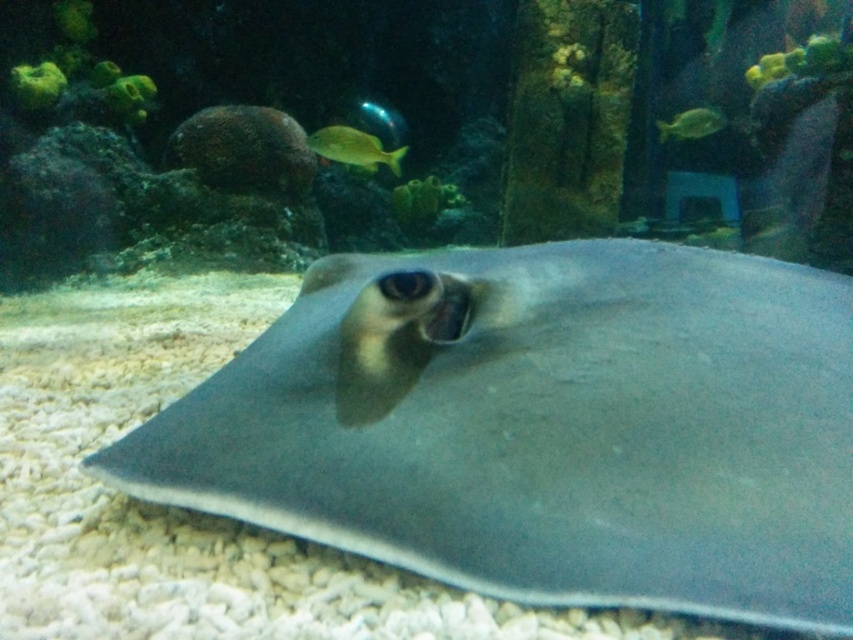
What are the coordinates of `smooth gray stingray at center` in the screenshot? It's located at (543, 426).

Does point (305, 365) lie in front of point (672, 128)?

That is True.

Is point (842, 448) positioned behind point (659, 125)?

No, it is not.

Identify the location of smooth gray stingray at center. The width and height of the screenshot is (853, 640). (543, 426).

Between yellow matte fish at upper center and green shiny fish at upper right, which one is positioned lower?

yellow matte fish at upper center is below.

Can you confirm if yellow matte fish at upper center is shorter than green shiny fish at upper right?

Correct, yellow matte fish at upper center is not as tall as green shiny fish at upper right.

Locate an element on the screen. This screenshot has height=640, width=853. yellow matte fish at upper center is located at coordinates (352, 147).

Which is more to the left, smooth gray stingray at center or yellow matte fish at upper center?

yellow matte fish at upper center is more to the left.

Is point (689, 401) positioned before point (347, 163)?

Yes, it is in front of point (347, 163).

I want to click on smooth gray stingray at center, so click(x=543, y=426).